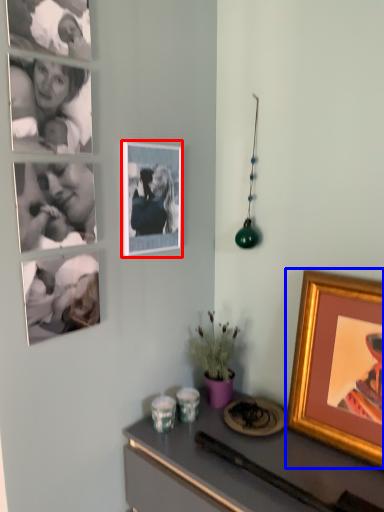
Question: Which point is further to the camera, picture frame (highlighted by a red box) or picture frame (highlighted by a blue box)?

Choices:
 (A) picture frame
 (B) picture frame

Answer: (A)